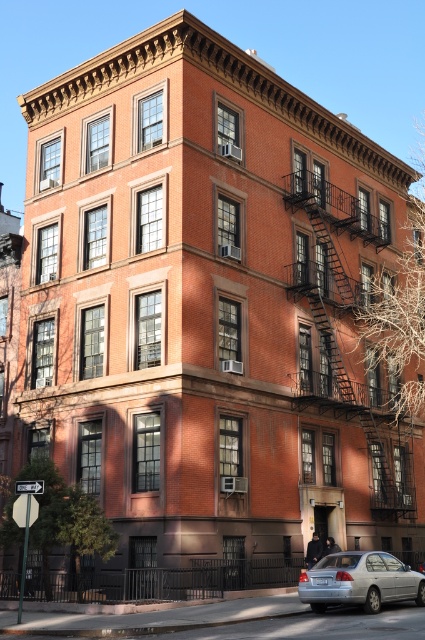
In the scene shown: You are a delivery person trying to park your silver metallic sedan at lower right near the building. There is a rustic metal fire escape at right attached to the building. Considering their sizes, will the fire escape block your parking space?

The rustic metal fire escape at right has a larger size compared to the silver metallic sedan at lower right, so it may block the parking space.

You are a delivery person trying to park your silver metallic sedan at lower right near the building. There is a rustic metal fire escape at right attached to the building. Considering their heights, will the fire escape block the view of the sedan from the street level?

The rustic metal fire escape at right is much taller than the silver metallic sedan at lower right, so it might block the view of the sedan from street level depending on the angle and distance.